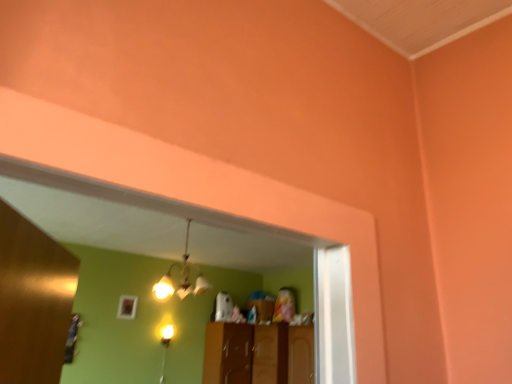
Question: From a real-world perspective, is matte brass chandelier at center over brown wood cabinet at center?

Choices:
 (A) no
 (B) yes

Answer: (B)

Question: Considering the relative sizes of matte brass chandelier at center and brown wood cabinet at center in the image provided, is matte brass chandelier at center bigger than brown wood cabinet at center?

Choices:
 (A) no
 (B) yes

Answer: (A)

Question: Would you say matte brass chandelier at center is outside brown wood cabinet at center?

Choices:
 (A) yes
 (B) no

Answer: (A)

Question: Is matte brass chandelier at center positioned in front of brown wood cabinet at center?

Choices:
 (A) no
 (B) yes

Answer: (B)

Question: Is matte brass chandelier at center turned away from brown wood cabinet at center?

Choices:
 (A) no
 (B) yes

Answer: (A)

Question: Is matte brass chandelier at center at the left side of brown wood cabinet at center?

Choices:
 (A) yes
 (B) no

Answer: (A)

Question: From the image's perspective, is brown wood cabinet at center beneath matte brass chandelier at center?

Choices:
 (A) yes
 (B) no

Answer: (A)

Question: Is brown wood cabinet at center to the right of matte brass chandelier at center from the viewer's perspective?

Choices:
 (A) no
 (B) yes

Answer: (B)

Question: Is brown wood cabinet at center to the left of matte brass chandelier at center from the viewer's perspective?

Choices:
 (A) no
 (B) yes

Answer: (A)

Question: Considering the relative sizes of brown wood cabinet at center and matte brass chandelier at center in the image provided, is brown wood cabinet at center smaller than matte brass chandelier at center?

Choices:
 (A) yes
 (B) no

Answer: (B)

Question: Can you confirm if brown wood cabinet at center is shorter than matte brass chandelier at center?

Choices:
 (A) yes
 (B) no

Answer: (B)

Question: Considering the relative sizes of brown wood cabinet at center and matte brass chandelier at center in the image provided, is brown wood cabinet at center taller than matte brass chandelier at center?

Choices:
 (A) no
 (B) yes

Answer: (B)

Question: From the image's perspective, relative to brown wood cabinet at center, is matte brass chandelier at center above or below?

Choices:
 (A) below
 (B) above

Answer: (B)